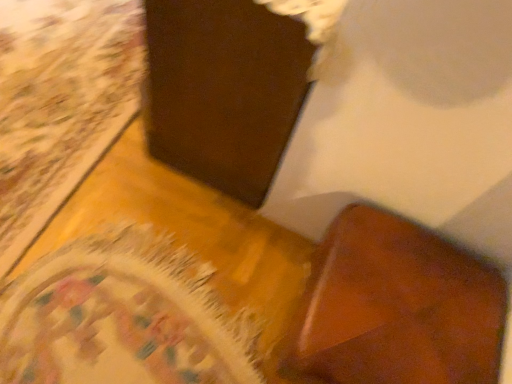
Describe the element at coordinates (398, 306) in the screenshot. I see `brown leather swivel chair at lower right` at that location.

This screenshot has width=512, height=384. In order to click on brown leather swivel chair at lower right in this screenshot , I will do point(398,306).

Find the location of `brown leather swivel chair at lower right`. brown leather swivel chair at lower right is located at coordinates (398, 306).